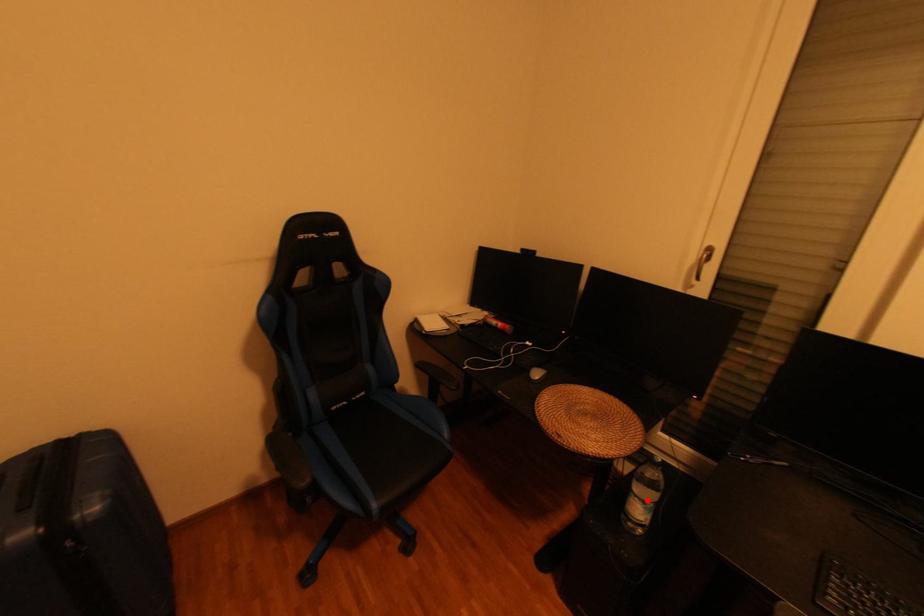
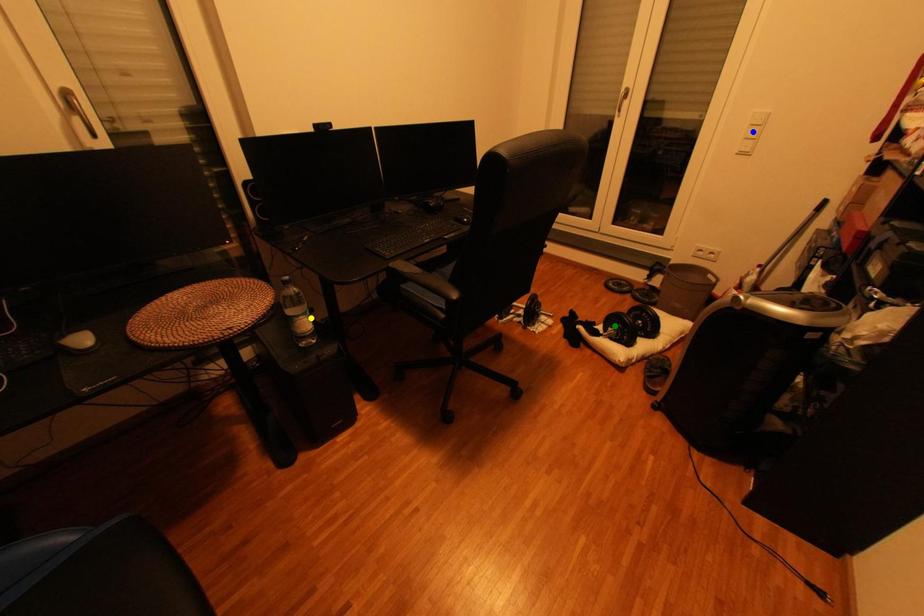
Question: I am providing you with two images of the same scene from different viewpoints. A red point is marked on the first image. You are given multiple points on the second image. Can you choose the point in image 2 that corresponds to the point in image 1?

Choices:
 (A) blue point
 (B) green point
 (C) yellow point

Answer: (C)